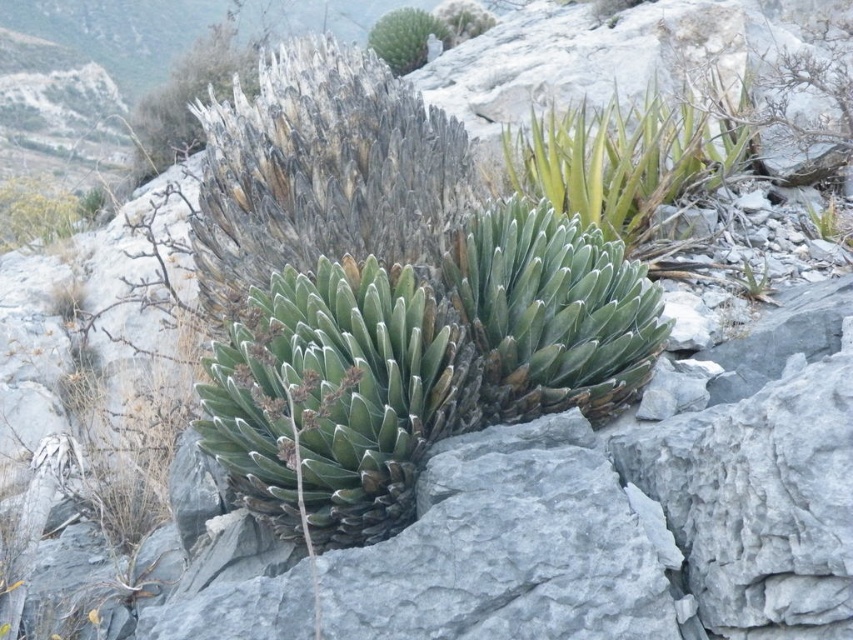
Question: Which object appears closest to the camera in this image?

Choices:
 (A) green leafy plant at upper right
 (B) green succulent at upper center

Answer: (A)

Question: Can you confirm if green leafy plant at upper right is smaller than green succulent at upper center?

Choices:
 (A) no
 (B) yes

Answer: (A)

Question: Can you confirm if green leafy plant at upper right is smaller than green succulent at upper center?

Choices:
 (A) yes
 (B) no

Answer: (B)

Question: Is green leafy plant at upper right positioned at the back of green succulent at upper center?

Choices:
 (A) yes
 (B) no

Answer: (B)